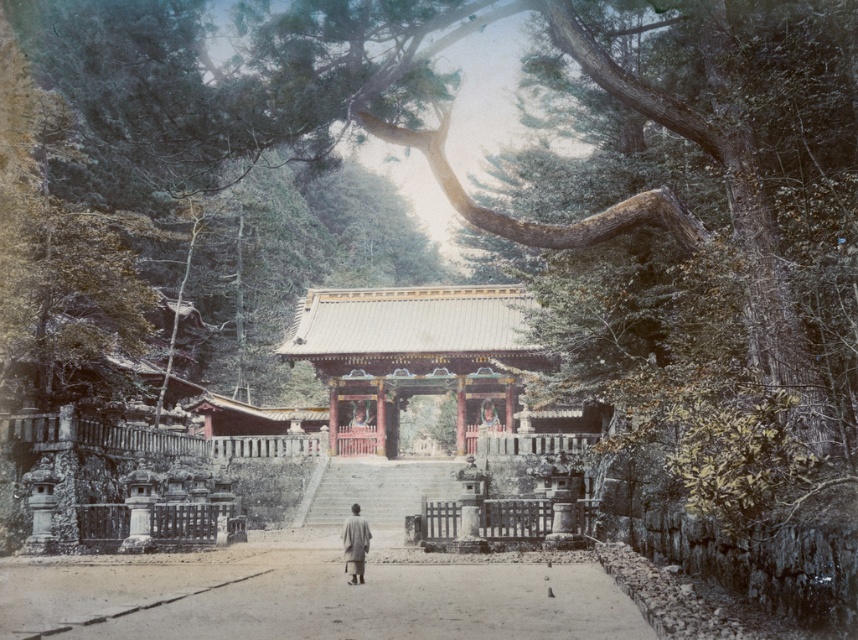
Question: Is smooth sand path at center further to the viewer compared to gray woolen robe at center?

Choices:
 (A) no
 (B) yes

Answer: (A)

Question: Among these points, which one is nearest to the camera?

Choices:
 (A) (361, 524)
 (B) (444, 573)

Answer: (A)

Question: Which object appears farthest from the camera in this image?

Choices:
 (A) gray woolen robe at center
 (B) smooth sand path at center

Answer: (A)

Question: Is smooth sand path at center to the right of gray woolen robe at center from the viewer's perspective?

Choices:
 (A) no
 (B) yes

Answer: (A)

Question: Is smooth sand path at center further to camera compared to gray woolen robe at center?

Choices:
 (A) no
 (B) yes

Answer: (A)